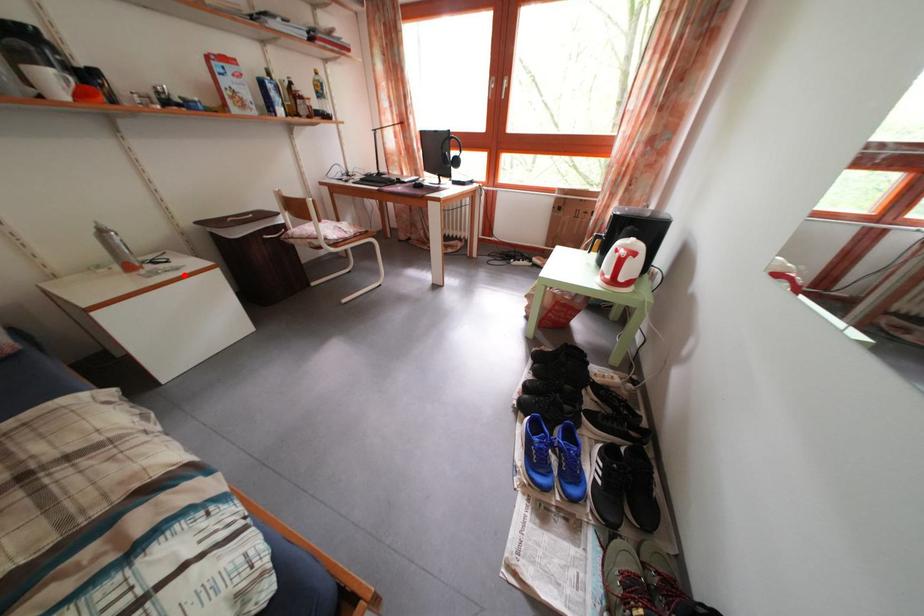
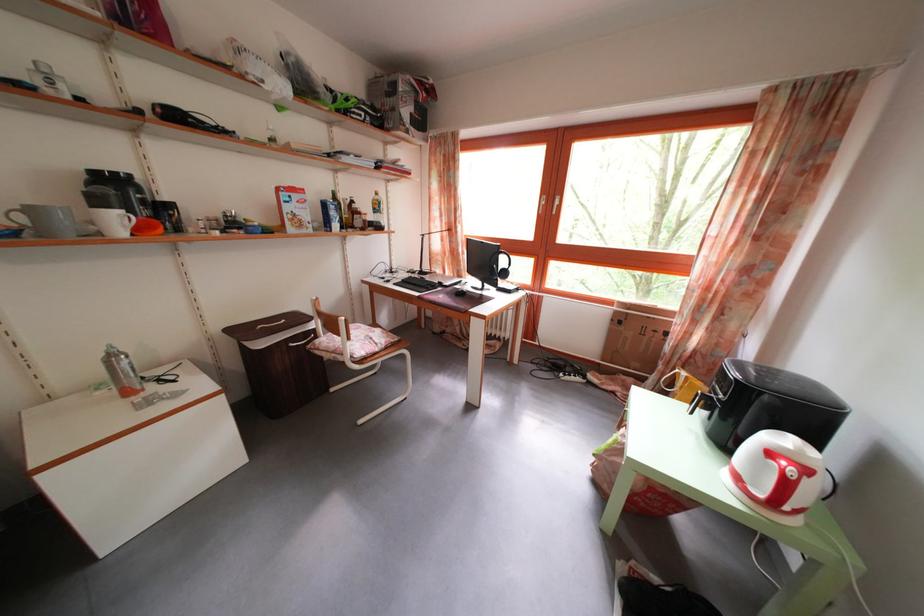
Find the pixel in the second image that matches the highlighted location in the first image.

(185, 402)